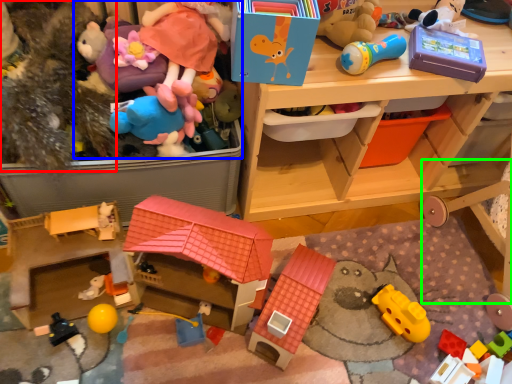
Question: Which object is the closest to the toy (highlighted by a red box)? Choose among these: toy (highlighted by a blue box) or bunk bed (highlighted by a green box).

Choices:
 (A) toy
 (B) bunk bed

Answer: (A)